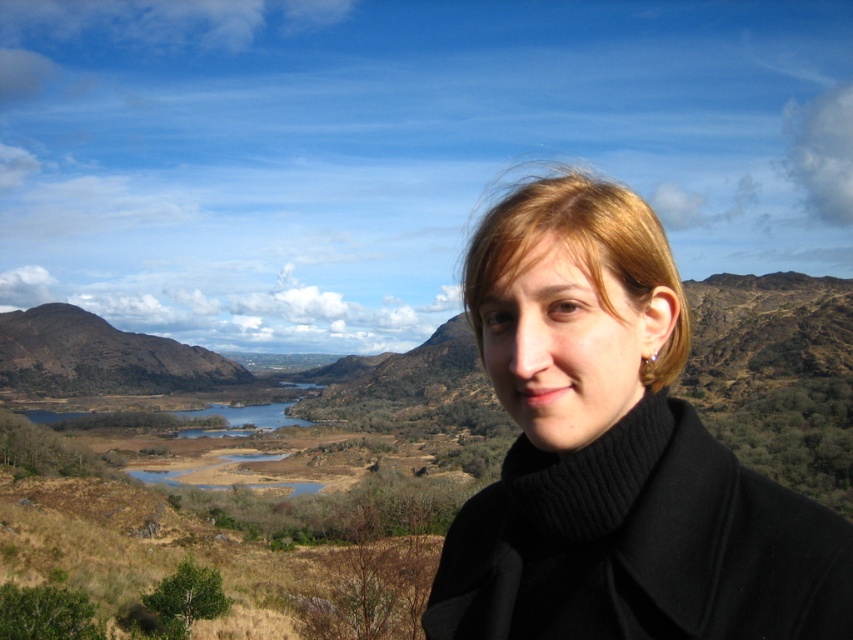
Question: Is black woolen coat at right to the right of brown textured mountain at left from the viewer's perspective?

Choices:
 (A) no
 (B) yes

Answer: (B)

Question: Which of the following is the closest to the observer?

Choices:
 (A) black woolen coat at right
 (B) brown textured mountain at left

Answer: (A)

Question: Among these points, which one is farthest from the camera?

Choices:
 (A) (628, 486)
 (B) (103, 349)

Answer: (B)

Question: Can you confirm if black woolen coat at right is thinner than brown textured mountain at left?

Choices:
 (A) yes
 (B) no

Answer: (A)

Question: Does black woolen coat at right have a lesser width compared to brown textured mountain at left?

Choices:
 (A) no
 (B) yes

Answer: (B)